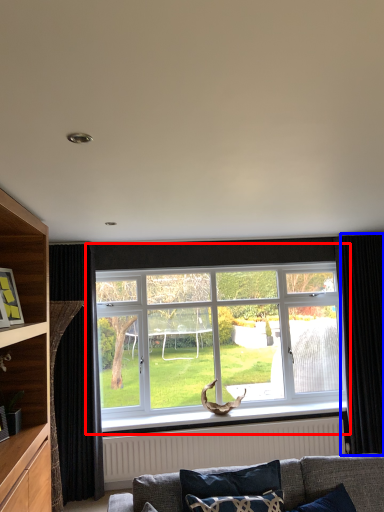
Question: Among these objects, which one is farthest to the camera, window (highlighted by a red box) or curtain (highlighted by a blue box)?

Choices:
 (A) window
 (B) curtain

Answer: (A)